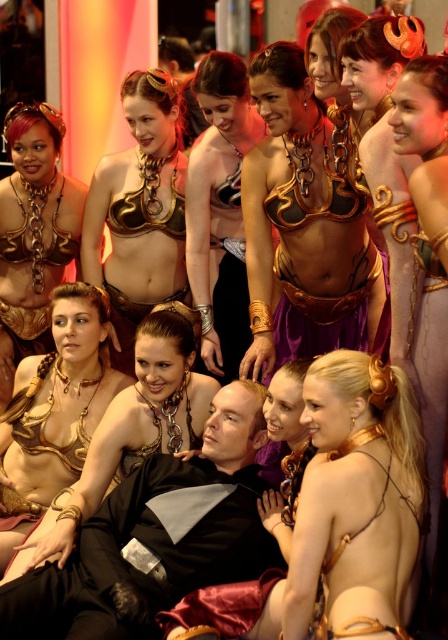
Which is more to the right, gold chainmail bikini top at upper center or metallic gold bikini top at center?

gold chainmail bikini top at upper center is more to the right.

Looking at this image, is gold chainmail bikini top at upper center below metallic gold bikini top at center?

Yes, gold chainmail bikini top at upper center is below metallic gold bikini top at center.

Does point (245, 369) lie behind point (206, 285)?

No, (245, 369) is closer to viewer.

The height and width of the screenshot is (640, 448). Find the location of `gold chainmail bikini top at upper center`. gold chainmail bikini top at upper center is located at coordinates (302, 227).

Consider the image. Does black matte suit at center have a lesser height compared to matte gold chainmail bikini top at upper center?

Indeed, black matte suit at center has a lesser height compared to matte gold chainmail bikini top at upper center.

Measure the distance between black matte suit at center and matte gold chainmail bikini top at upper center.

They are 14.36 feet apart.

Who is more distant from viewer, (124, 557) or (151, 262)?

Positioned behind is point (151, 262).

The height and width of the screenshot is (640, 448). Identify the location of black matte suit at center. (155, 538).

Who is taller, metallic gold bikini top at center or matte gold chainmail bikini top at center?

matte gold chainmail bikini top at center

What do you see at coordinates (219, 211) in the screenshot? I see `metallic gold bikini top at center` at bounding box center [219, 211].

Who is more forward, (211, 333) or (30, 221)?

Point (211, 333)

Image resolution: width=448 pixels, height=640 pixels. In order to click on metallic gold bikini top at center in this screenshot , I will do `click(219, 211)`.